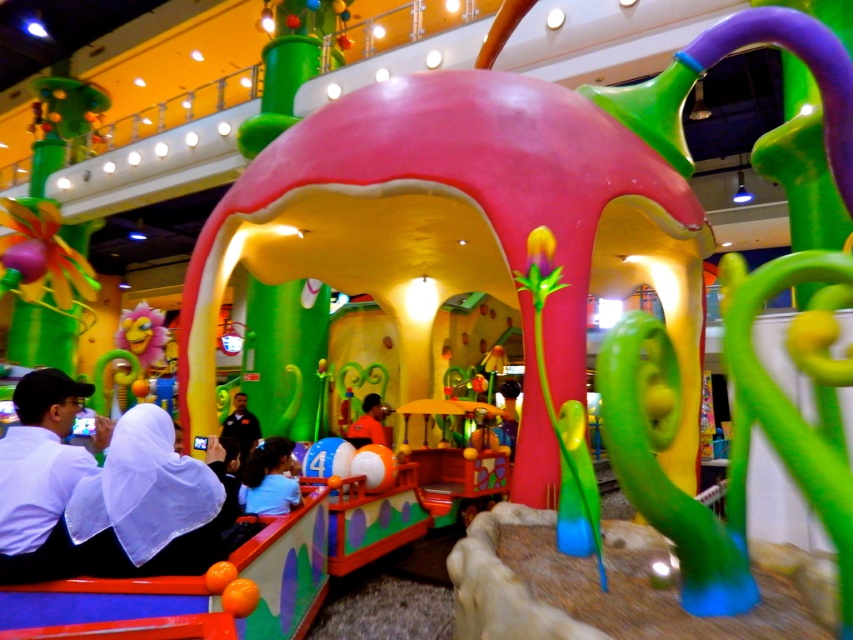
You are a visitor standing at the entrance of the amusement ride. You notice two points marked in the scene. Which point, point (20, 403) or point (379, 412), is nearer to you?

Point (20, 403) is closer to the viewer than point (379, 412).

You are a maintenance worker needing to reach both the white matte shirt at lower left and the black matte shirt at center for inspection. Given that your ladder can extend up to 5 meters, can you safely reach both shirts without moving the ladder?

The white matte shirt at lower left and the black matte shirt at center are 5.50 meters apart. Since the ladder can only extend up to 5 meters, you cannot safely reach both shirts without moving the ladder because the distance between them exceeds the ladder extension limit.